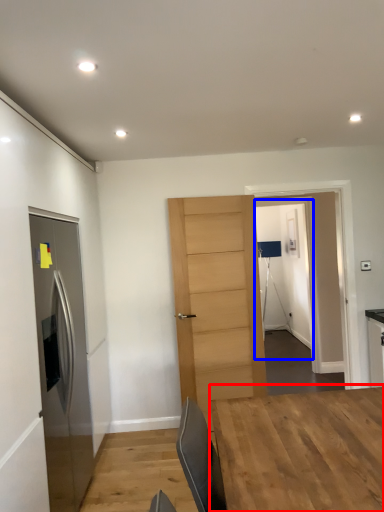
Question: Which object is closer to the camera taking this photo, table (highlighted by a red box) or glass door (highlighted by a blue box)?

Choices:
 (A) table
 (B) glass door

Answer: (A)